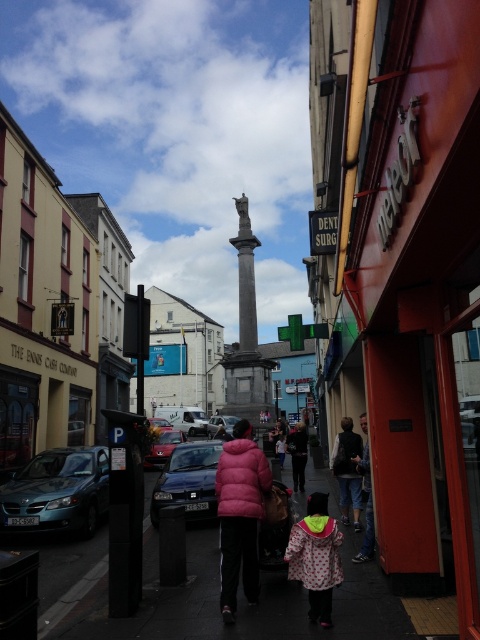
Question: Is smooth asphalt pavement at center above velvet black jacket at lower right?

Choices:
 (A) yes
 (B) no

Answer: (B)

Question: Can you confirm if granite column at center is positioned to the right of fluffy pink coat at center?

Choices:
 (A) no
 (B) yes

Answer: (A)

Question: Which is nearer to the metallic silver car at center?

Choices:
 (A) pink matte jacket at center
 (B) matte black car at center

Answer: (B)

Question: Is fluffy pink coat at center positioned at the back of metallic silver car at center?

Choices:
 (A) no
 (B) yes

Answer: (A)

Question: Which point appears farthest from the camera in this image?

Choices:
 (A) (41, 465)
 (B) (159, 429)
 (C) (344, 508)
 (D) (284, 442)

Answer: (B)

Question: Among these objects, which one is farthest from the camera?

Choices:
 (A) shiny black sedan at center
 (B) granite column at center

Answer: (B)